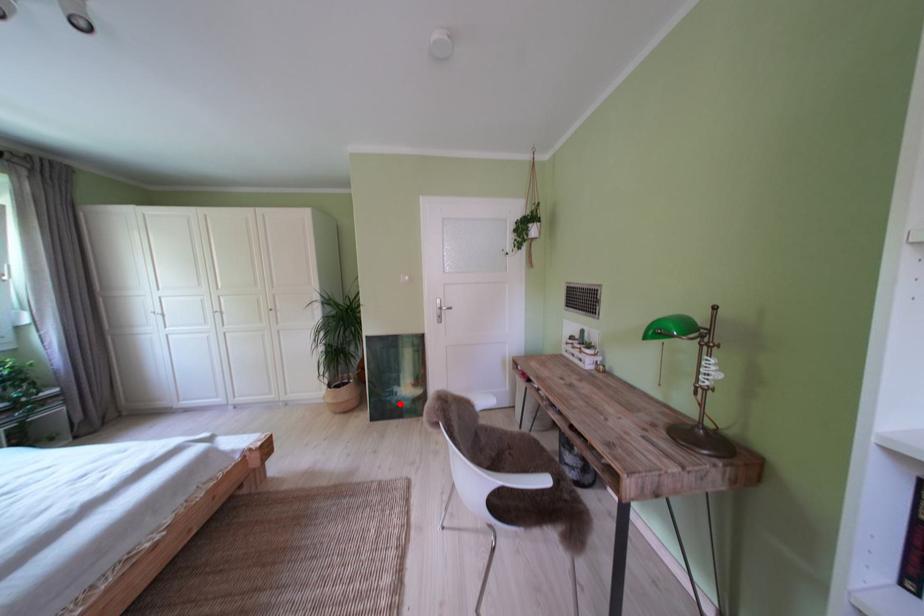
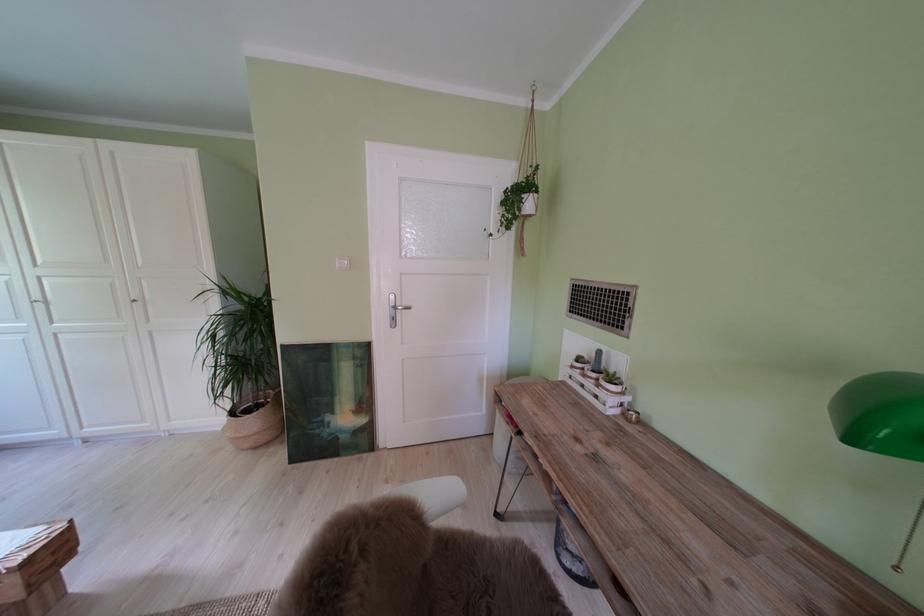
Where in the second image is the point corresponding to the highlighted location from the first image?

(329, 437)